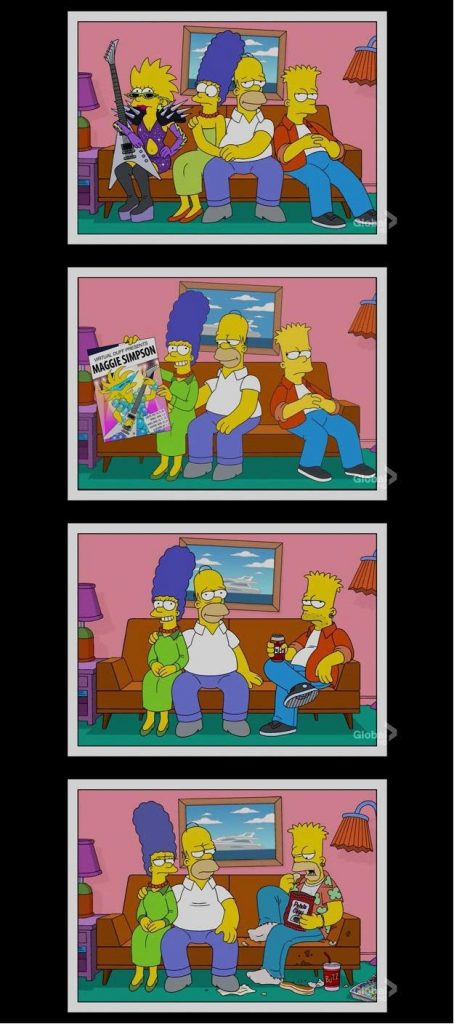
The image size is (454, 1024). In order to click on sofa in this screenshot , I will do `click(243, 888)`, `click(254, 628)`, `click(266, 369)`, `click(275, 111)`.